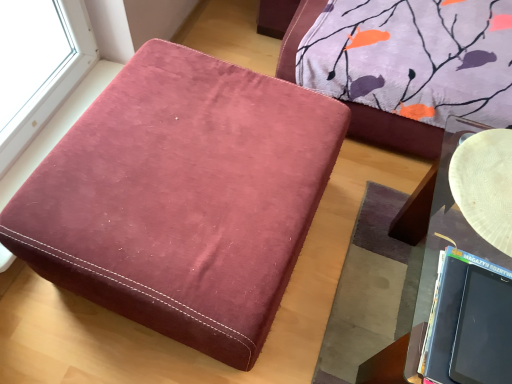
The height and width of the screenshot is (384, 512). Identify the location of white textured plate at right. (485, 185).

Locate an element on the screen. This screenshot has width=512, height=384. matte black laptop at lower right is located at coordinates (469, 322).

What do you see at coordinates (469, 322) in the screenshot? I see `matte black laptop at lower right` at bounding box center [469, 322].

Find the location of a particular element. white textured plate at right is located at coordinates (485, 185).

Is point (266, 317) more distant than point (478, 277)?

Yes, it is.

Considering the relative sizes of velvet-like burgundy ottoman at center and matte black laptop at lower right in the image provided, is velvet-like burgundy ottoman at center thinner than matte black laptop at lower right?

No, velvet-like burgundy ottoman at center is not thinner than matte black laptop at lower right.

From the image's perspective, is velvet-like burgundy ottoman at center under matte black laptop at lower right?

No, from the image's perspective, velvet-like burgundy ottoman at center is not beneath matte black laptop at lower right.

Is matte black laptop at lower right facing away from velvet-like burgundy ottoman at center?

No, matte black laptop at lower right is not facing the opposite direction of velvet-like burgundy ottoman at center.

Is matte black laptop at lower right wider than velvet-like burgundy ottoman at center?

Incorrect, the width of matte black laptop at lower right does not surpass that of velvet-like burgundy ottoman at center.

Measure the distance between matte black laptop at lower right and velvet-like burgundy ottoman at center.

The distance of matte black laptop at lower right from velvet-like burgundy ottoman at center is 23.78 inches.

Is matte black laptop at lower right located outside velvet-like burgundy ottoman at center?

matte black laptop at lower right lies outside velvet-like burgundy ottoman at center's area.

Is there a large distance between velvet-like burgundy ottoman at center and white textured plate at right?

They are positioned close to each other.

From a real-world perspective, is velvet-like burgundy ottoman at center on white textured plate at right?

No, from a real-world perspective, velvet-like burgundy ottoman at center is not on top of white textured plate at right.

Based on their sizes in the image, would you say velvet-like burgundy ottoman at center is bigger or smaller than white textured plate at right?

Clearly, velvet-like burgundy ottoman at center is larger in size than white textured plate at right.

Which of these two, white textured plate at right or velvet-like burgundy ottoman at center, is wider?

With larger width is velvet-like burgundy ottoman at center.

From the image's perspective, which one is positioned lower, white textured plate at right or velvet-like burgundy ottoman at center?

velvet-like burgundy ottoman at center, from the image's perspective.

Is white textured plate at right shorter than velvet-like burgundy ottoman at center?

Indeed, white textured plate at right has a lesser height compared to velvet-like burgundy ottoman at center.

What are the coordinates of `laptop to the left of white textured plate at right` in the screenshot? It's located at (469, 322).

From the picture: From a real-world perspective, who is located higher, white textured plate at right or matte black laptop at lower right?

matte black laptop at lower right is physically above.

Is point (490, 134) farther from camera compared to point (506, 294)?

That is True.

From the image's perspective, which is below, white textured plate at right or matte black laptop at lower right?

matte black laptop at lower right.

In the scene shown: Which is behind, matte black laptop at lower right or white textured plate at right?

Positioned behind is white textured plate at right.

How different are the orientations of matte black laptop at lower right and white textured plate at right in degrees?

matte black laptop at lower right and white textured plate at right are facing 2.3 degrees away from each other.

From a real-world perspective, between matte black laptop at lower right and white textured plate at right, who is vertically lower?

From a 3D spatial view, white textured plate at right is below.

Between matte black laptop at lower right and white textured plate at right, which one has larger size?

white textured plate at right is bigger.

You are a GUI agent. You are given a task and a screenshot of the screen. Output one action in this format:
    pyautogui.click(x=<x>, y=<y>)
    Task: Click on the furniture lying behind the matte black laptop at lower right
    
    Given the screenshot: What is the action you would take?
    pyautogui.click(x=182, y=198)

The height and width of the screenshot is (384, 512). There is a velvet-like burgundy ottoman at center. Identify the location of laptop above it (from a real-world perspective). (469, 322).

Looking at the image, which one is located further to velvet-like burgundy ottoman at center, white textured plate at right or matte black laptop at lower right?

white textured plate at right.

Estimate the real-world distances between objects in this image. Which object is further from matte black laptop at lower right, white textured plate at right or velvet-like burgundy ottoman at center?

Among the two, velvet-like burgundy ottoman at center is located further to matte black laptop at lower right.

When comparing their distances from matte black laptop at lower right, does velvet-like burgundy ottoman at center or white textured plate at right seem closer?

The object closer to matte black laptop at lower right is white textured plate at right.

Based on their spatial positions, is matte black laptop at lower right or white textured plate at right further from velvet-like burgundy ottoman at center?

The object further to velvet-like burgundy ottoman at center is white textured plate at right.

Which object lies nearer to the anchor point white textured plate at right, velvet-like burgundy ottoman at center or matte black laptop at lower right?

Among the two, matte black laptop at lower right is located nearer to white textured plate at right.

Considering their positions, is matte black laptop at lower right positioned closer to white textured plate at right than velvet-like burgundy ottoman at center?

matte black laptop at lower right.

Locate an element on the screen. laptop between velvet-like burgundy ottoman at center and white textured plate at right from left to right is located at coordinates (469, 322).